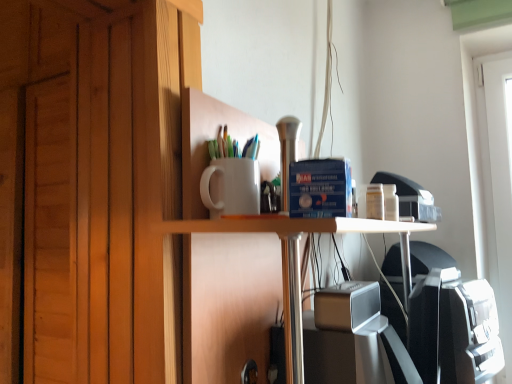
Question: Is the depth of white matte cup at upper center greater than that of satin silver speaker at center?

Choices:
 (A) no
 (B) yes

Answer: (B)

Question: Can you confirm if white matte cup at upper center is shorter than satin silver speaker at center?

Choices:
 (A) no
 (B) yes

Answer: (A)

Question: Is white matte cup at upper center taller than satin silver speaker at center?

Choices:
 (A) yes
 (B) no

Answer: (A)

Question: Is white matte cup at upper center oriented away from satin silver speaker at center?

Choices:
 (A) yes
 (B) no

Answer: (B)

Question: From a real-world perspective, is white matte cup at upper center located beneath satin silver speaker at center?

Choices:
 (A) yes
 (B) no

Answer: (B)

Question: Considering the positions of point (296, 357) and point (74, 301), is point (296, 357) closer or farther from the camera than point (74, 301)?

Choices:
 (A) farther
 (B) closer

Answer: (B)

Question: In terms of width, does white glossy table at center look wider or thinner when compared to white matte cup at upper center?

Choices:
 (A) wide
 (B) thin

Answer: (B)

Question: From a real-world perspective, is white glossy table at center above or below white matte cup at upper center?

Choices:
 (A) above
 (B) below

Answer: (B)

Question: Is white glossy table at center bigger or smaller than white matte cup at upper center?

Choices:
 (A) small
 (B) big

Answer: (A)

Question: Is white glossy table at center to the left or to the right of satin silver speaker at center in the image?

Choices:
 (A) left
 (B) right

Answer: (B)

Question: From a real-world perspective, is white glossy table at center above or below satin silver speaker at center?

Choices:
 (A) below
 (B) above

Answer: (A)

Question: Is white glossy table at center bigger or smaller than satin silver speaker at center?

Choices:
 (A) small
 (B) big

Answer: (B)

Question: Considering their positions, is white glossy table at center located in front of or behind satin silver speaker at center?

Choices:
 (A) behind
 (B) front

Answer: (B)

Question: In terms of width, does white matte cup at upper center look wider or thinner when compared to white glossy table at center?

Choices:
 (A) thin
 (B) wide

Answer: (B)

Question: Considering the positions of white matte cup at upper center and white glossy table at center in the image, is white matte cup at upper center taller or shorter than white glossy table at center?

Choices:
 (A) tall
 (B) short

Answer: (A)